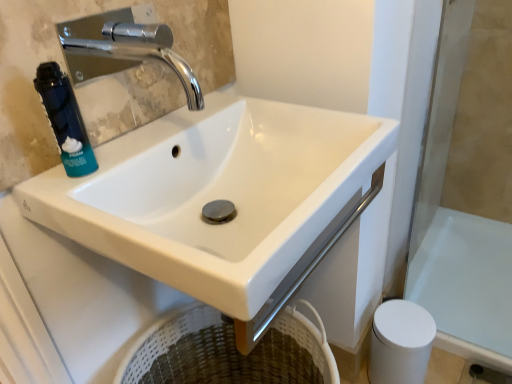
You are a GUI agent. You are given a task and a screenshot of the screen. Output one action in this format:
    pyautogui.click(x=<x>, y=<y>)
    Task: Click on the unoccupied space behind blue matte foam canister at left
    
    Given the screenshot: What is the action you would take?
    (x=148, y=138)